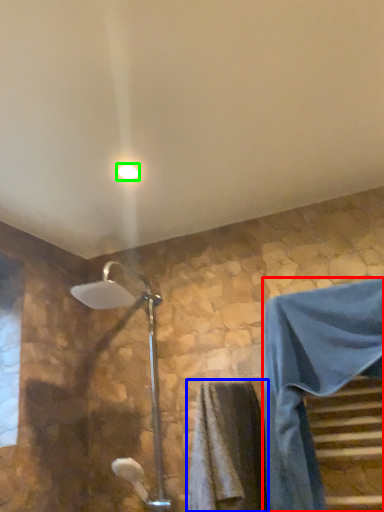
Question: Which object is positioned closest to robe (highlighted by a red box)? Select from bath towel (highlighted by a blue box) and light fixture (highlighted by a green box).

Choices:
 (A) bath towel
 (B) light fixture

Answer: (A)